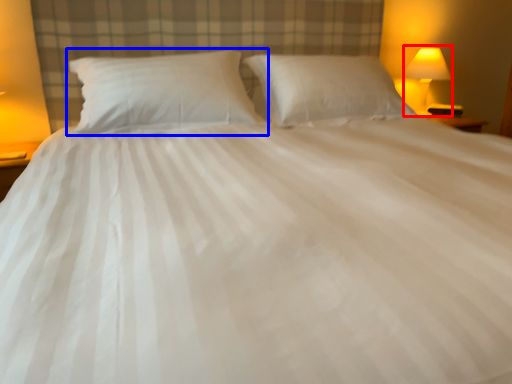
Question: Which of the following is the farthest to the observer, bedside lamp (highlighted by a red box) or pillow (highlighted by a blue box)?

Choices:
 (A) bedside lamp
 (B) pillow

Answer: (A)